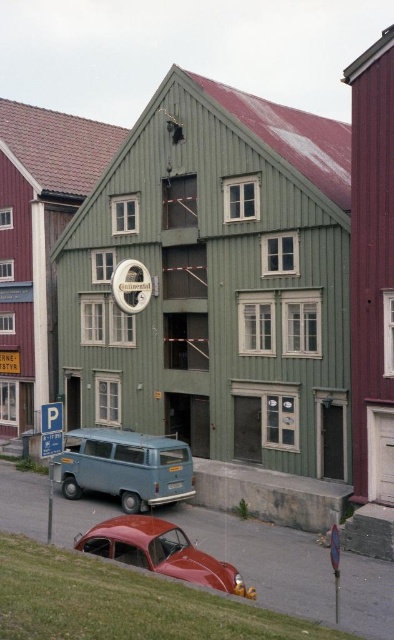
Is matte blue van at lower left smaller than shiny red car at lower left?

No, matte blue van at lower left is not smaller than shiny red car at lower left.

Can you confirm if matte blue van at lower left is positioned above shiny red car at lower left?

Yes.

Is point (94, 445) positioned behind point (126, 532)?

Yes.

You are a GUI agent. You are given a task and a screenshot of the screen. Output one action in this format:
    pyautogui.click(x=<x>, y=<y>)
    Task: Click on the matte blue van at lower left
    The height and width of the screenshot is (640, 394).
    Given the screenshot: What is the action you would take?
    pyautogui.click(x=126, y=467)